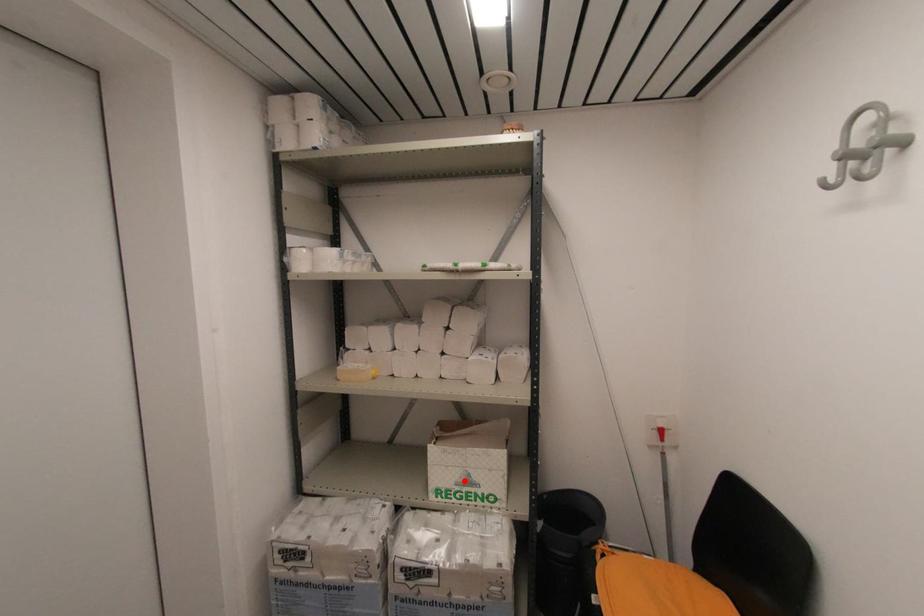
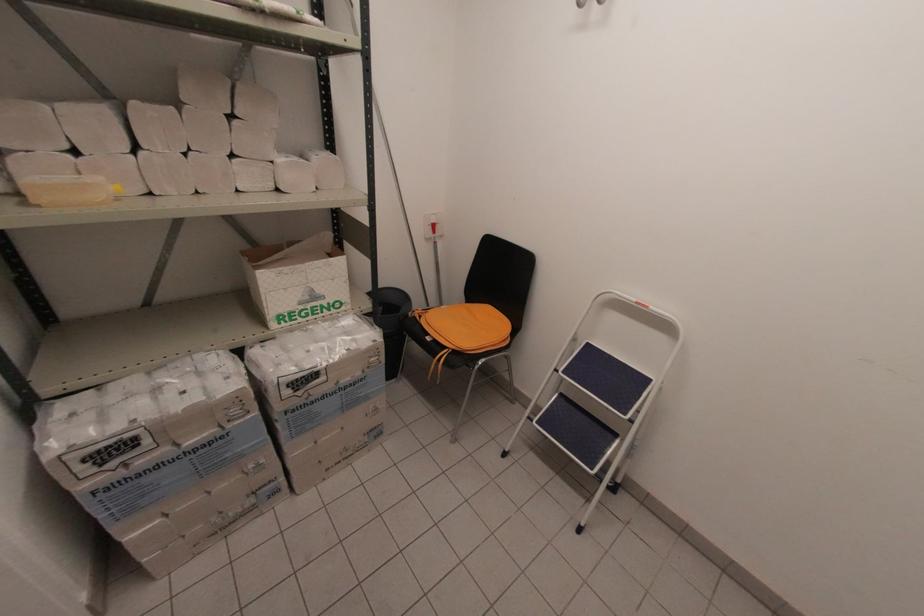
Find the pixel in the second image that matches the highlighted location in the first image.

(309, 298)